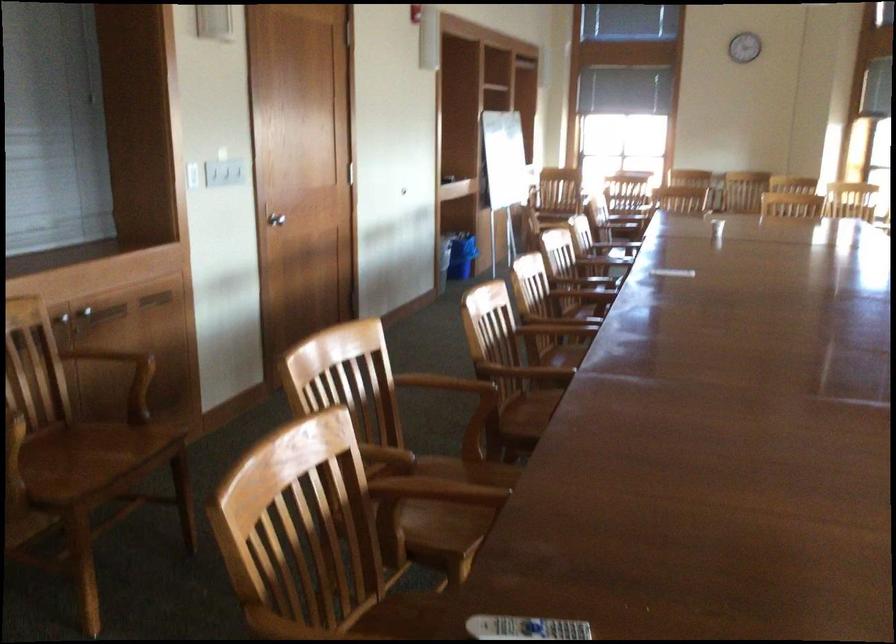
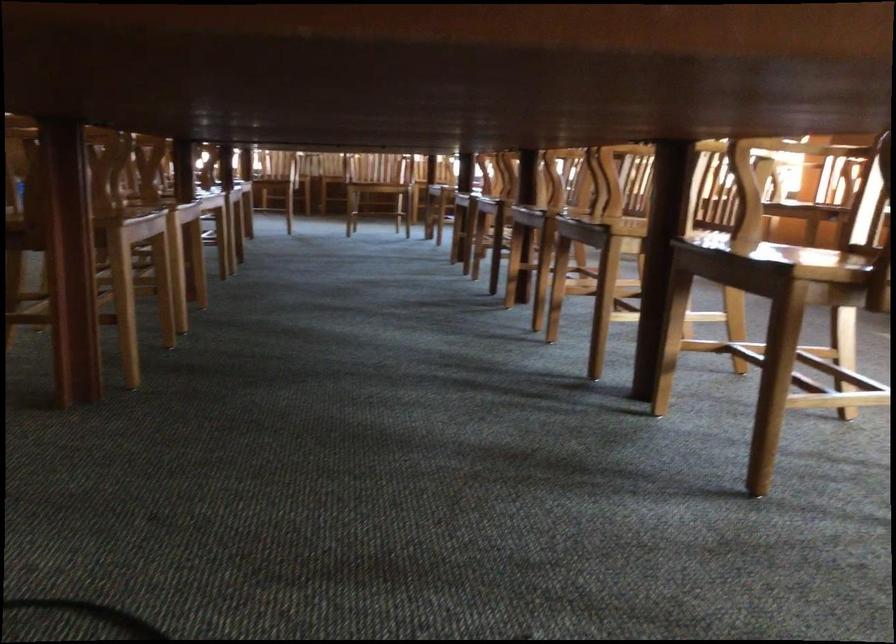
Which direction would the cameraman need to move to produce the second image?

The cameraman moved toward right, forward.